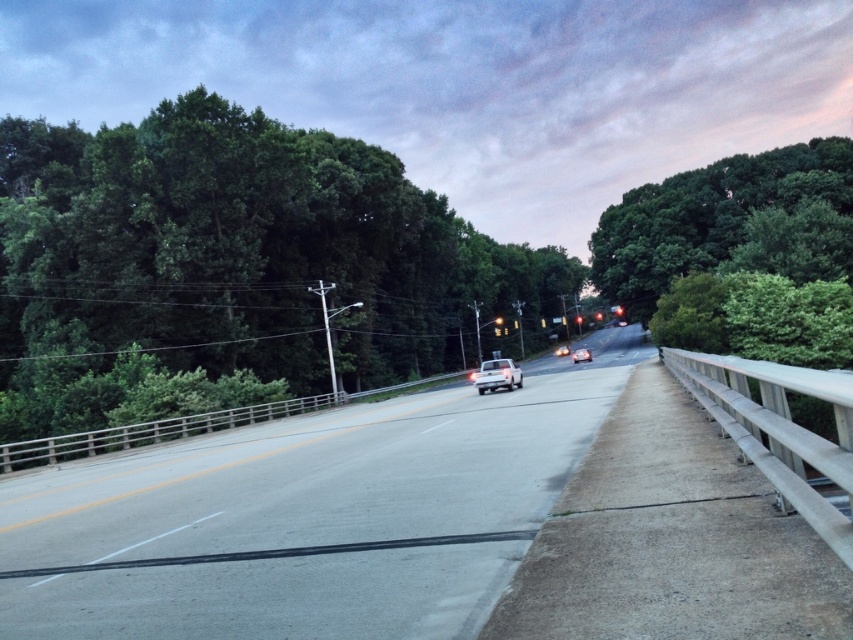
Question: Does white matte car at center have a larger size compared to red glass traffic light at center?

Choices:
 (A) yes
 (B) no

Answer: (A)

Question: Which of the following is the farthest from the observer?

Choices:
 (A) red glass traffic light at center
 (B) green leafy tree at left
 (C) white matte car at center

Answer: (A)

Question: Which point is closer to the camera?

Choices:
 (A) (585, 349)
 (B) (567, 348)
 (C) (502, 381)

Answer: (C)

Question: Which is farther from the white matte truck at center?

Choices:
 (A) green leafy tree at upper right
 (B) shiny silver sedan at center

Answer: (B)

Question: Observing the image, what is the correct spatial positioning of gray asphalt highway at center in reference to shiny silver sedan at center?

Choices:
 (A) above
 (B) below

Answer: (B)

Question: Does green leafy tree at upper right appear on the left side of white matte car at center?

Choices:
 (A) no
 (B) yes

Answer: (A)